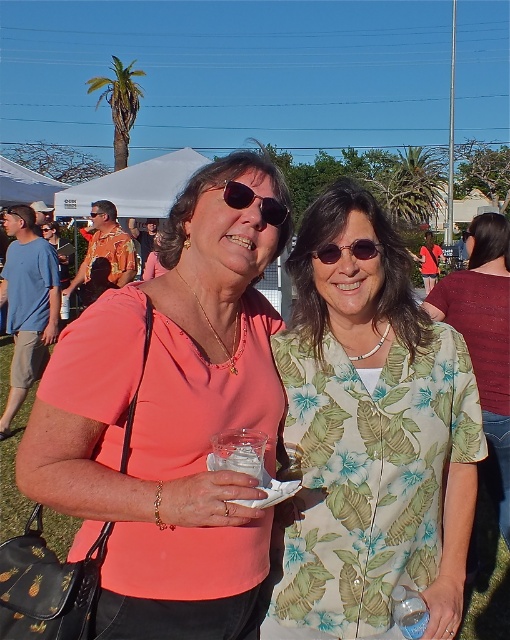
You are at a social event and want to take a photo of the two women. The camera you are using has a focal length of 50mm and an aperture of f2.8. The point at coordinates point (296, 572) is 5.72 feet away from the camera. To ensure both women are in focus, what should the minimum hyperfocal distance be?

The hyperfocal distance is the closest distance at which a lens can be focused while keeping objects at infinity acceptably sharp. Given the point at coordinates point (296, 572) is 5.72 feet away from the camera, the hyperfocal distance must be set to at least 5.72 feet to ensure both women are in focus.

Based on the photo, you are a photographer at the event and want to capture a closeup of the coral shirt. The point at [169,420] is marked on the image. Which object is this point located on?

The point at [169,420] is located on the matte coral shirt at center.